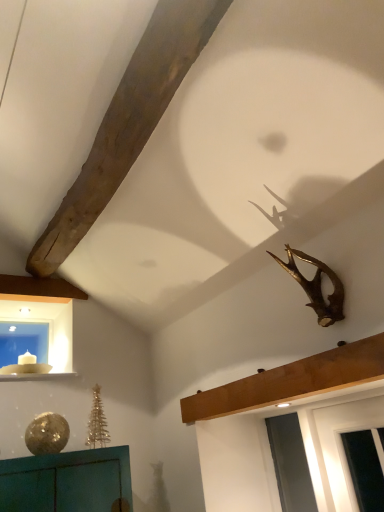
Question: Is point (46, 340) closer or farther from the camera than point (11, 377)?

Choices:
 (A) closer
 (B) farther

Answer: (B)

Question: From the image's perspective, relative to white glossy window sill at lower left, is blue glass window at lower left above or below?

Choices:
 (A) above
 (B) below

Answer: (A)

Question: Which object is positioned farthest from the gold metallic antlers at upper right?

Choices:
 (A) blue glass window at lower left
 (B) wooden beam at upper center
 (C) white glossy window sill at lower left

Answer: (A)

Question: Estimate the real-world distances between objects in this image. Which object is farther from the wooden beam at upper center?

Choices:
 (A) white glossy window sill at lower left
 (B) blue glass window at lower left
 (C) gold metallic antlers at upper right

Answer: (B)